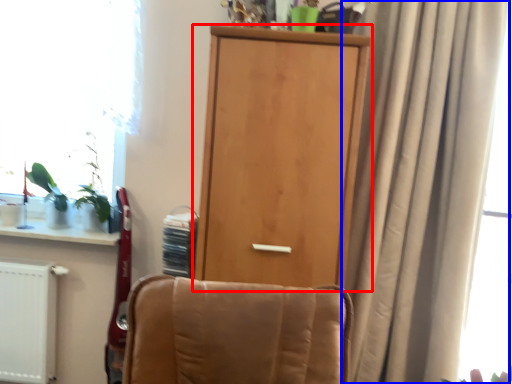
Question: Which object is further to the camera taking this photo, door (highlighted by a red box) or curtain (highlighted by a blue box)?

Choices:
 (A) door
 (B) curtain

Answer: (A)